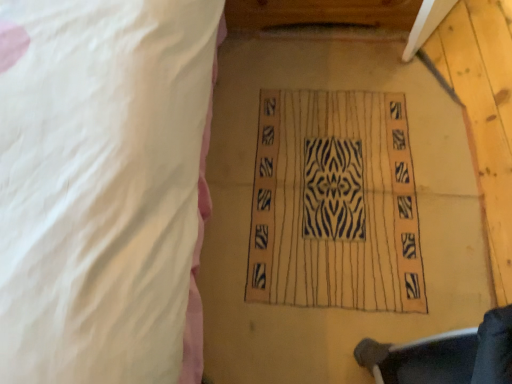
Find the location of `zebra-patterned fabric at center`. zebra-patterned fabric at center is located at coordinates (335, 203).

The height and width of the screenshot is (384, 512). Describe the element at coordinates (335, 203) in the screenshot. I see `zebra-patterned fabric at center` at that location.

This screenshot has height=384, width=512. What are the coordinates of `zebra-patterned fabric at center` in the screenshot? It's located at click(335, 203).